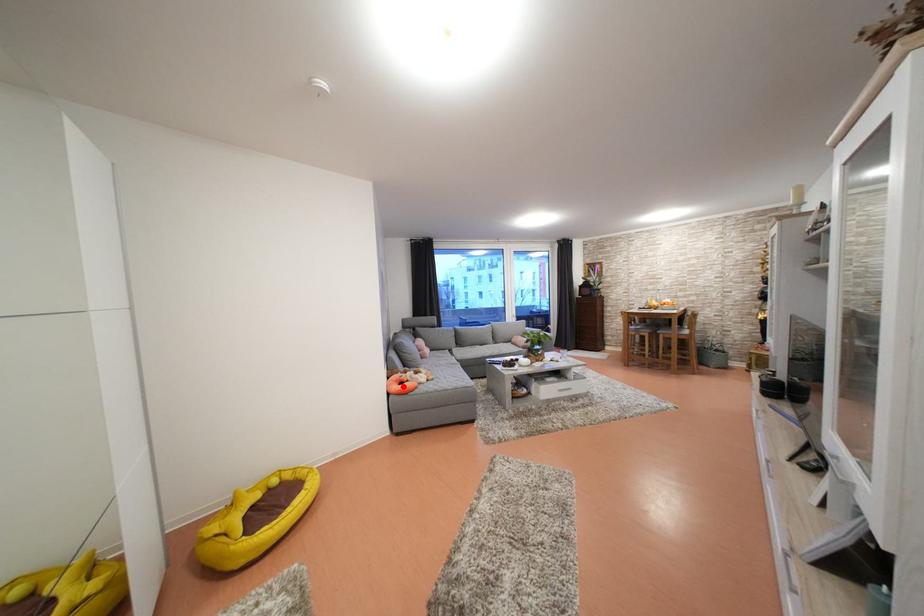
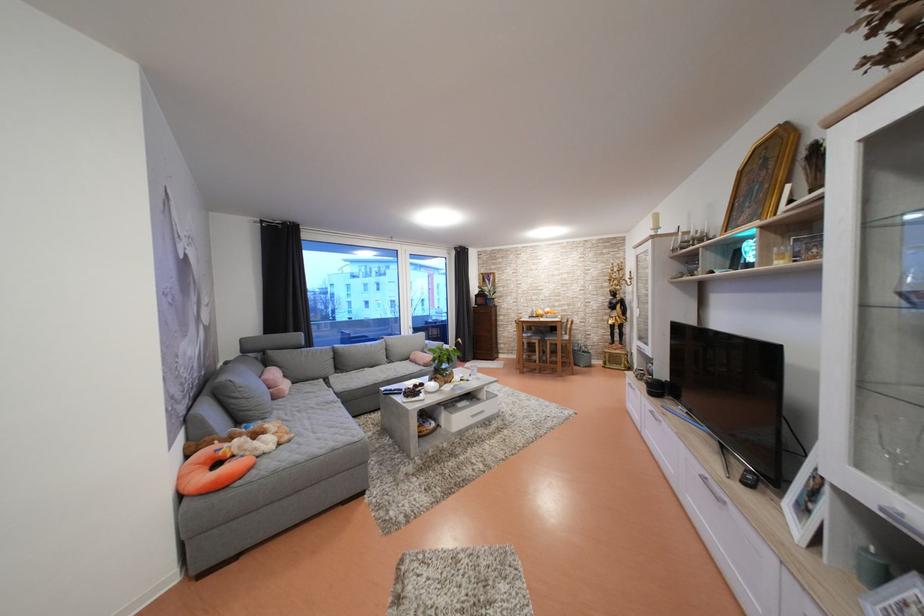
Where in the second image is the point corresponding to the highlighted location from the first image?

(211, 469)